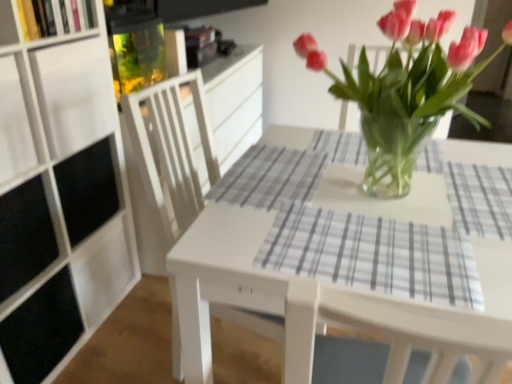
Question: Is white glossy table at center oriented away from wooden bookshelf at upper left, the 2th shelf positioned from the bottom?

Choices:
 (A) no
 (B) yes

Answer: (A)

Question: Is white glossy table at center facing towards wooden bookshelf at upper left, the 2th shelf positioned from the bottom?

Choices:
 (A) no
 (B) yes

Answer: (A)

Question: Can you confirm if white glossy table at center is shorter than wooden bookshelf at upper left, marked as the first shelf in a top-to-bottom arrangement?

Choices:
 (A) yes
 (B) no

Answer: (B)

Question: Considering the relative sizes of white glossy table at center and wooden bookshelf at upper left, marked as the first shelf in a top-to-bottom arrangement, in the image provided, is white glossy table at center bigger than wooden bookshelf at upper left, marked as the first shelf in a top-to-bottom arrangement,?

Choices:
 (A) no
 (B) yes

Answer: (B)

Question: Is wooden bookshelf at upper left, the 2th shelf positioned from the bottom, a part of white glossy table at center?

Choices:
 (A) yes
 (B) no

Answer: (B)

Question: From the image's perspective, is white glossy table at center over wooden bookshelf at upper left, marked as the first shelf in a top-to-bottom arrangement?

Choices:
 (A) yes
 (B) no

Answer: (B)

Question: Is white matte shelf at upper left, which is counted as the 2th shelf, starting from the top, smaller than gray plaid placemat at center?

Choices:
 (A) no
 (B) yes

Answer: (A)

Question: Does white matte shelf at upper left, which is counted as the 1th shelf, starting from the bottom, come behind gray plaid placemat at center?

Choices:
 (A) no
 (B) yes

Answer: (B)

Question: Is white matte shelf at upper left, which is counted as the 2th shelf, starting from the top, positioned beyond the bounds of gray plaid placemat at center?

Choices:
 (A) no
 (B) yes

Answer: (B)

Question: Is white matte shelf at upper left, which is counted as the 2th shelf, starting from the top, at the right side of gray plaid placemat at center?

Choices:
 (A) no
 (B) yes

Answer: (A)

Question: From the image's perspective, is white matte shelf at upper left, which is counted as the 2th shelf, starting from the top, beneath gray plaid placemat at center?

Choices:
 (A) no
 (B) yes

Answer: (A)

Question: Can you confirm if white matte shelf at upper left, which is counted as the 1th shelf, starting from the bottom, is bigger than gray plaid placemat at center?

Choices:
 (A) yes
 (B) no

Answer: (A)

Question: Is pink glass vase at center thinner than white glossy table at center?

Choices:
 (A) no
 (B) yes

Answer: (B)